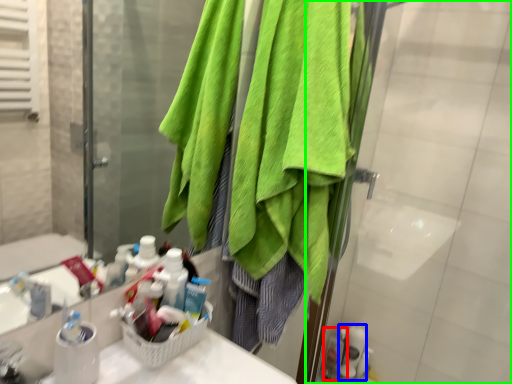
Question: Which is farther away from toiletry (highlighted by a red box)? toiletry (highlighted by a blue box) or screen door (highlighted by a green box)?

Choices:
 (A) toiletry
 (B) screen door

Answer: (B)